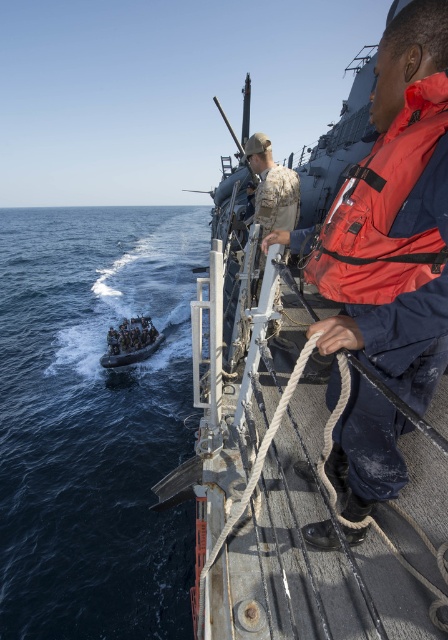
Who is taller, dark blue water at lower left or dark blue fabric life vest at lower center?

With more height is dark blue water at lower left.

Is point (176, 371) farther from camera compared to point (117, 358)?

Yes, it is behind point (117, 358).

This screenshot has width=448, height=640. In order to click on dark blue water at lower left in this screenshot , I will do `click(94, 420)`.

Measure the distance between point (52, 420) and camera.

Point (52, 420) is 13.53 meters from camera.

Can you confirm if dark blue water at lower left is shorter than rustic wooden boat at center?

Incorrect, dark blue water at lower left's height does not fall short of rustic wooden boat at center's.

Which is behind, point (8, 296) or point (442, 51)?

Point (8, 296)

Locate an element on the screen. dark blue water at lower left is located at coordinates (94, 420).

Between dark blue water at lower left and red matte life jacket at upper right, which one is positioned higher?

Positioned higher is dark blue water at lower left.

Is point (24, 355) positioned behind point (348, 205)?

Yes, it is behind point (348, 205).

Identify the location of dark blue water at lower left. The height and width of the screenshot is (640, 448). (94, 420).